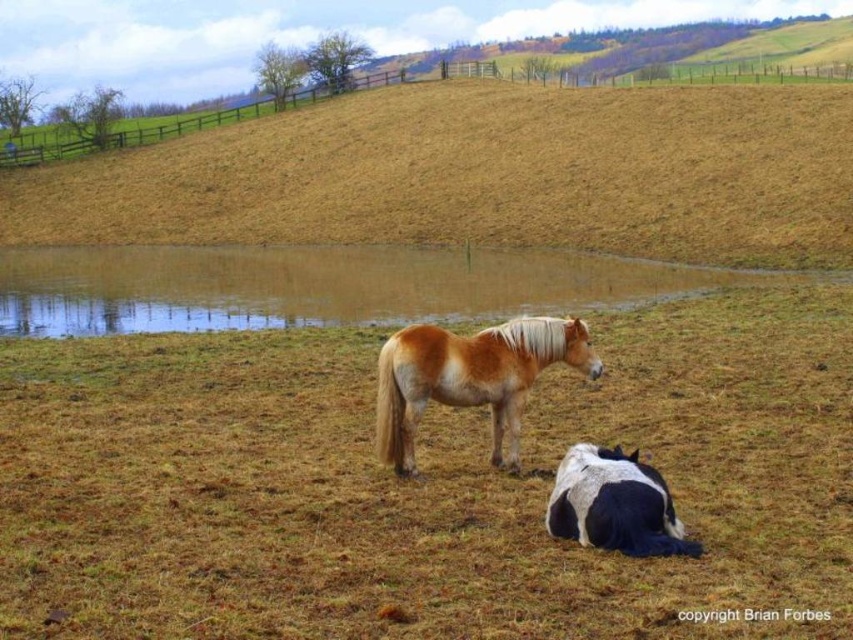
You are a farmer checking the field. You notice the brown dry grass at center and the black and white speckled horse at lower right. Which object is taller?

The brown dry grass at center is much taller than the black and white speckled horse at lower right.

You are a farmer who needs to determine if there is enough space to move the black and white speckled horse at lower right to the area with brown dry grass at center. Based on the scene, can the horse fit in that area?

The brown dry grass at center is larger in size than the black and white speckled horse at lower right, so the horse can fit in the area with brown dry grass at center.

You are standing at the point marked as point (323, 285) in the image. What do you see at that location?

At point (323, 285) lies brown water at center.